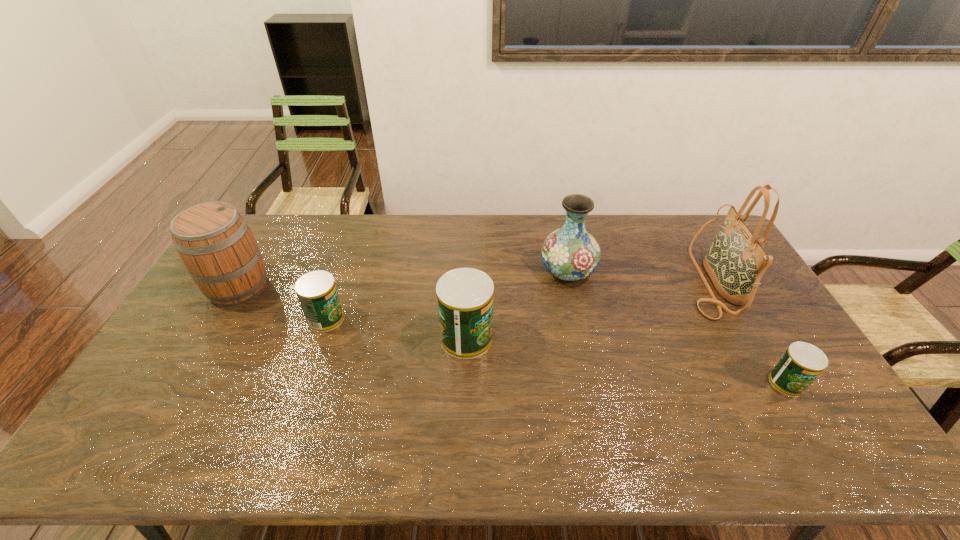
You are a GUI agent. You are given a task and a screenshot of the screen. Output one action in this format:
    pyautogui.click(x=<x>, y=<y>)
    Task: Click on the leftmost can
    The image size is (960, 540).
    Given the screenshot: What is the action you would take?
    pyautogui.click(x=316, y=290)

Locate an element on the screen. Image resolution: width=960 pixels, height=540 pixels. the second shortest object is located at coordinates (316, 290).

Locate an element on the screen. The width and height of the screenshot is (960, 540). the tallest can is located at coordinates (465, 296).

Locate an element on the screen. the second can from right to left is located at coordinates (465, 296).

At what (x,y) coordinates should I click in order to perform the action: click on the shortest can. Please return your answer as a coordinate pair (x, y). Looking at the image, I should click on (801, 364).

This screenshot has width=960, height=540. In order to click on the nearest object in this screenshot , I will do `click(801, 364)`.

The image size is (960, 540). I want to click on the tallest object, so click(x=735, y=262).

The height and width of the screenshot is (540, 960). Identify the location of the third object from right to left. (570, 253).

Identify the location of the leftmost object. (214, 242).

You are a GUI agent. You are given a task and a screenshot of the screen. Output one action in this format:
    pyautogui.click(x=<x>, y=<y>)
    Task: Click on the vacant position located 0.230m on the right of the fifth object from right to left
    The image size is (960, 540).
    Given the screenshot: What is the action you would take?
    pyautogui.click(x=419, y=319)